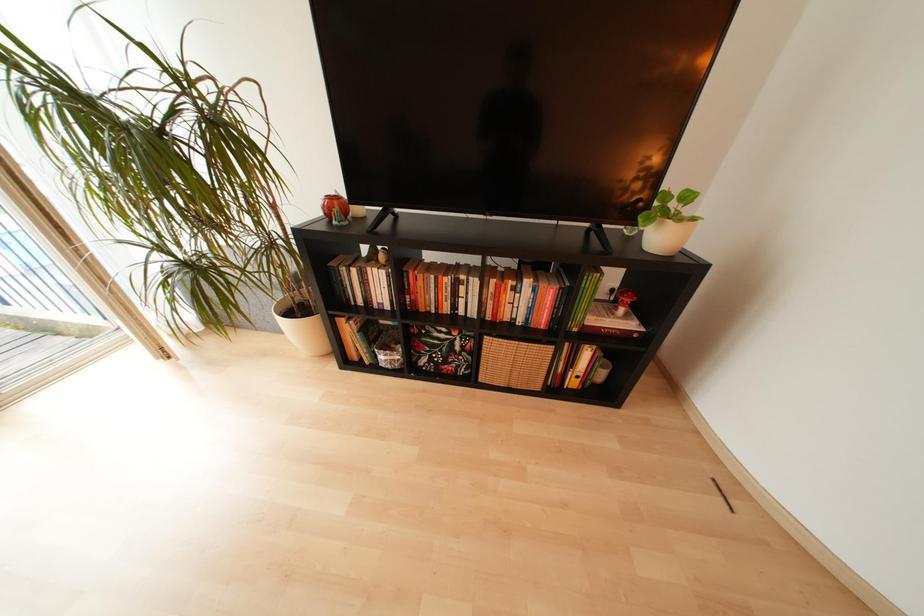
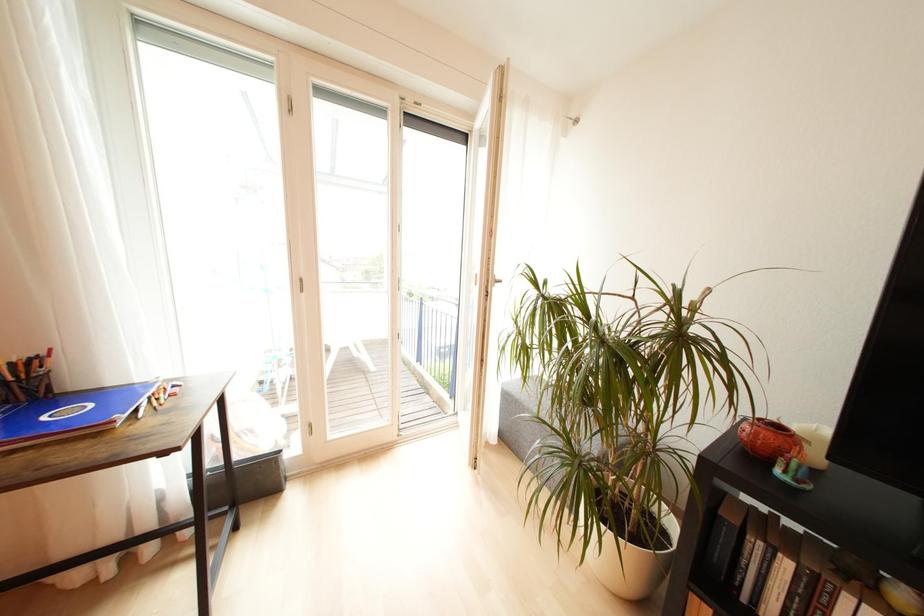
Question: The first image is from the beginning of the video and the second image is from the end. How did the camera likely rotate when shooting the video?

Choices:
 (A) Left
 (B) Right
 (C) Up
 (D) Down

Answer: (A)